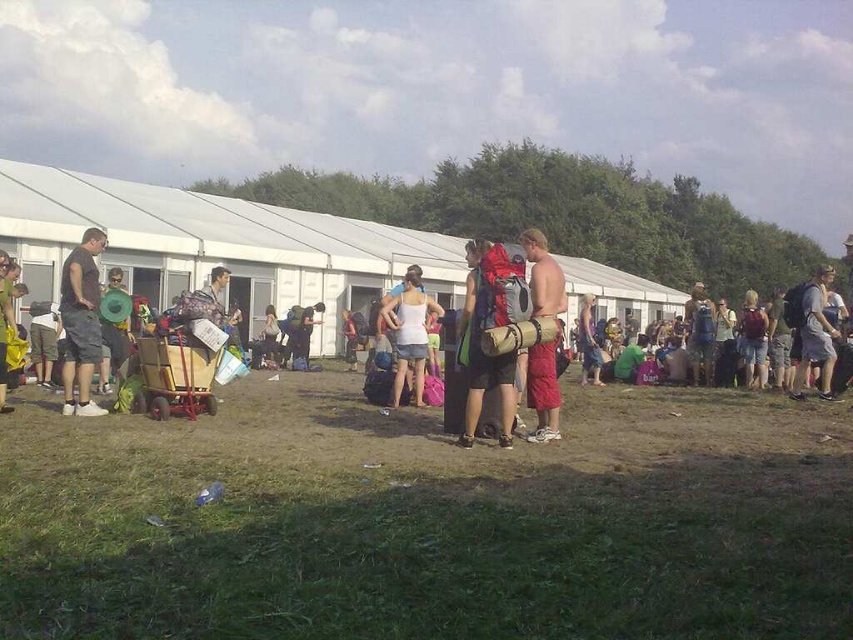
You are standing at the edge of the festival grounds and see both the matte gray backpack at center and the white matte tank top at center. Which object is physically nearer to you?

The matte gray backpack at center is closer to the viewer than the white matte tank top at center.

You are standing at the entrance of the tent and want to locate the shiny metallic drum at center. According to the coordinates provided, in which direction should you walk to find it?

The shiny metallic drum at center is located at coordinates point (543, 392). Since you are at the entrance of the tent, you should walk towards the center of the image to find it.